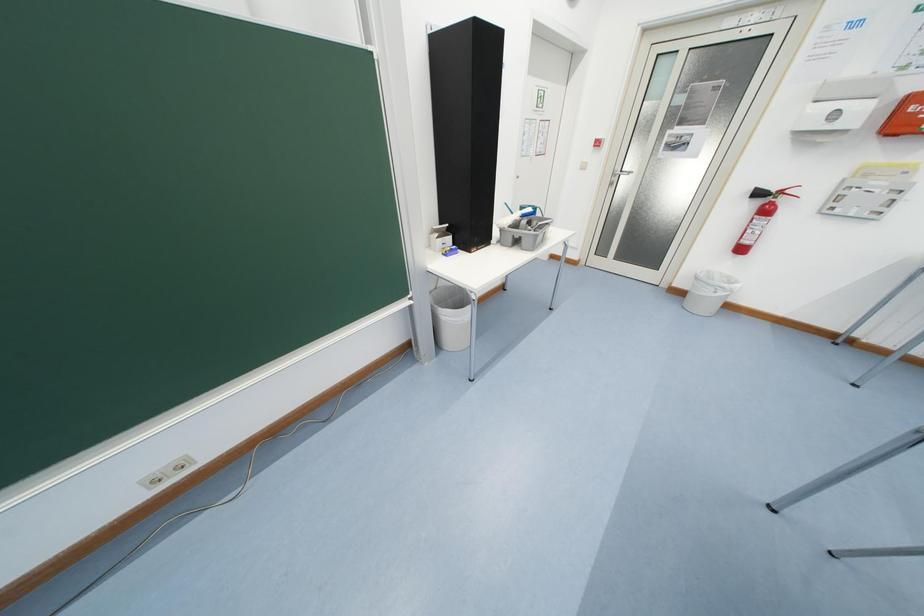
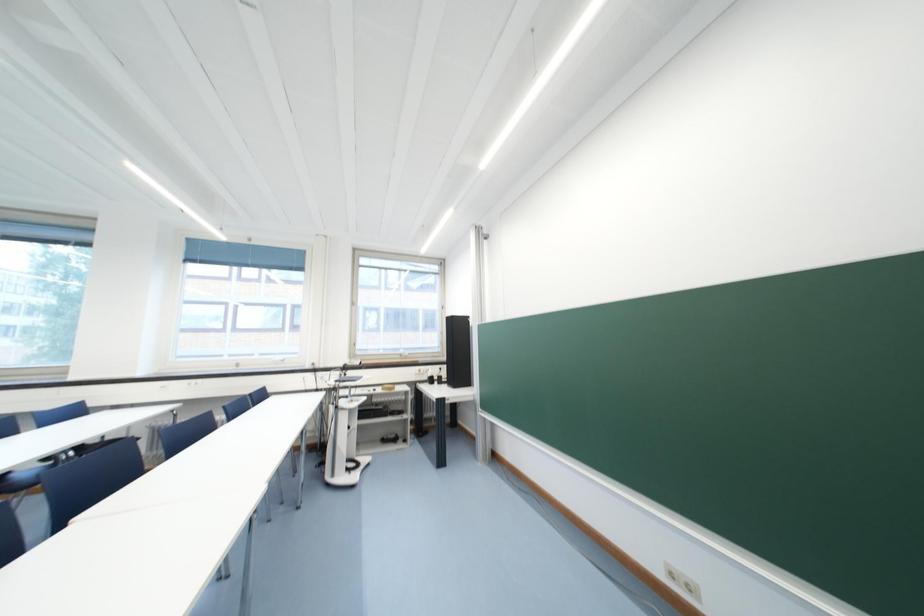
Question: The images are taken continuously from a first-person perspective. In which direction is your viewpoint rotating?

Choices:
 (A) Left
 (B) Right
 (C) Up
 (D) Down

Answer: (A)